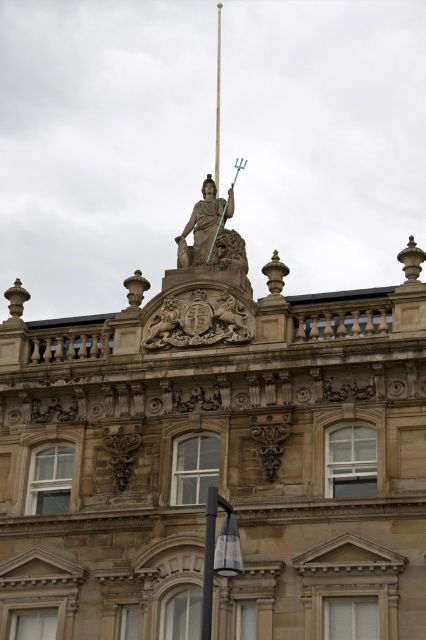
Does brown stone statue at upper center have a lesser width compared to gold stone coat of arms at center?

No, brown stone statue at upper center is not thinner than gold stone coat of arms at center.

I want to click on brown stone statue at upper center, so click(216, 464).

Between point (0, 353) and point (207, 320), which one is positioned behind?

Positioned behind is point (0, 353).

The image size is (426, 640). What are the coordinates of `brown stone statue at upper center` in the screenshot? It's located at (216, 464).

Is brown stone statue at upper center bigger than green glass pole at upper center?

Correct, brown stone statue at upper center is larger in size than green glass pole at upper center.

The width and height of the screenshot is (426, 640). Describe the element at coordinates (216, 464) in the screenshot. I see `brown stone statue at upper center` at that location.

The image size is (426, 640). I want to click on brown stone statue at upper center, so click(216, 464).

The height and width of the screenshot is (640, 426). Find the location of `brown stone statue at upper center`. brown stone statue at upper center is located at coordinates (216, 464).

Can you confirm if gold stone coat of arms at center is bigger than green glass pole at upper center?

No.

Does gold stone coat of arms at center appear over green glass pole at upper center?

Incorrect, gold stone coat of arms at center is not positioned above green glass pole at upper center.

Is point (224, 301) behind point (218, 134)?

No, it is not.

You are a GUI agent. You are given a task and a screenshot of the screen. Output one action in this format:
    pyautogui.click(x=<x>, y=<y>)
    Task: Click on the gold stone coat of arms at center
    This screenshot has width=426, height=640.
    Given the screenshot: What is the action you would take?
    pyautogui.click(x=198, y=321)